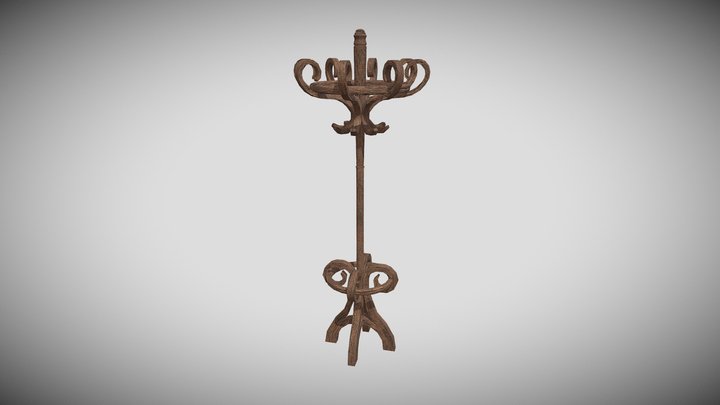
Where is `middle pole of rack`? The height and width of the screenshot is (405, 720). middle pole of rack is located at coordinates (359, 197).